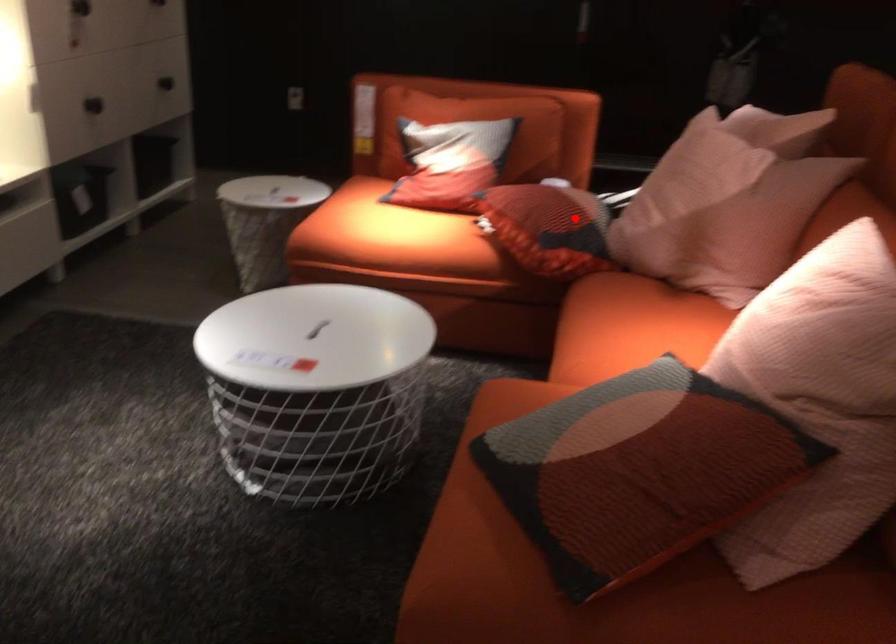
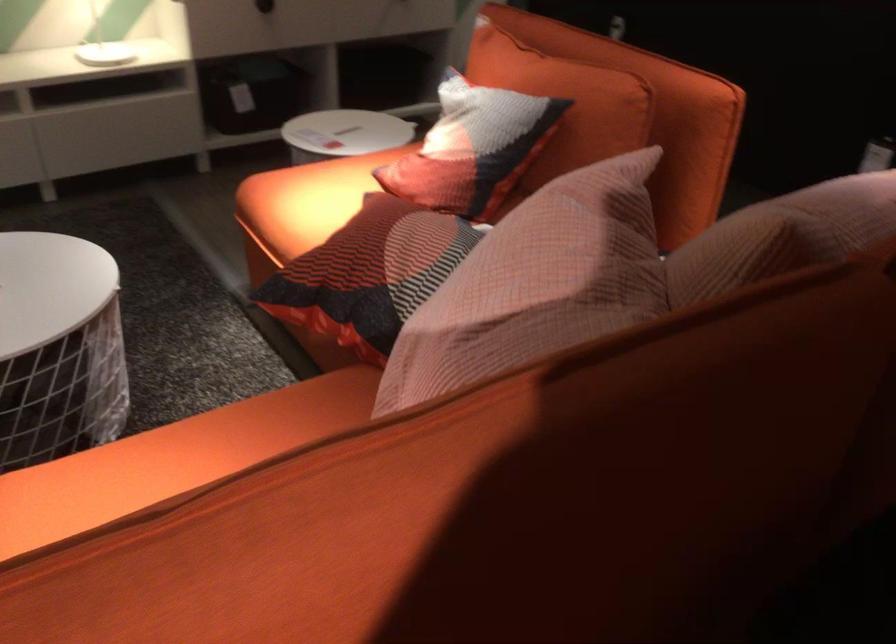
Question: I am providing you with two images of the same scene from different viewpoints. Image1 has a red point marked. In image2, the corresponding 3D location appears at what relative position? Reply with the corresponding letter.

Choices:
 (A) Closer
 (B) Farther

Answer: (A)